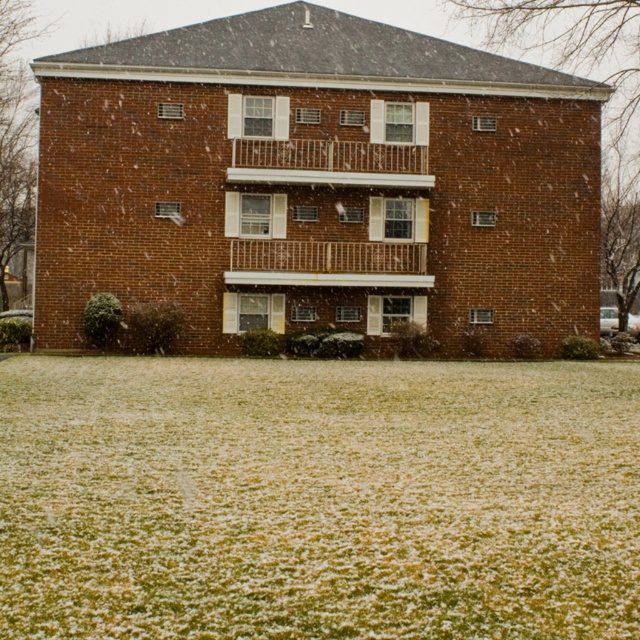
Question: Which object is farther from the camera taking this photo?

Choices:
 (A) white metal railing at upper center
 (B) green grass at lower center

Answer: (A)

Question: Which point is farther to the camera?

Choices:
 (A) (332, 182)
 (B) (237, 442)

Answer: (A)

Question: Which of the following is the closest to the observer?

Choices:
 (A) (234, 358)
 (B) (397, 156)

Answer: (A)

Question: In this image, where is green grass at lower center located relative to white metal railing at upper center?

Choices:
 (A) right
 (B) left

Answer: (B)

Question: Can you confirm if green grass at lower center is positioned below white metal railing at upper center?

Choices:
 (A) no
 (B) yes

Answer: (B)

Question: Is the position of green grass at lower center less distant than that of white metal railing at upper center?

Choices:
 (A) no
 (B) yes

Answer: (B)